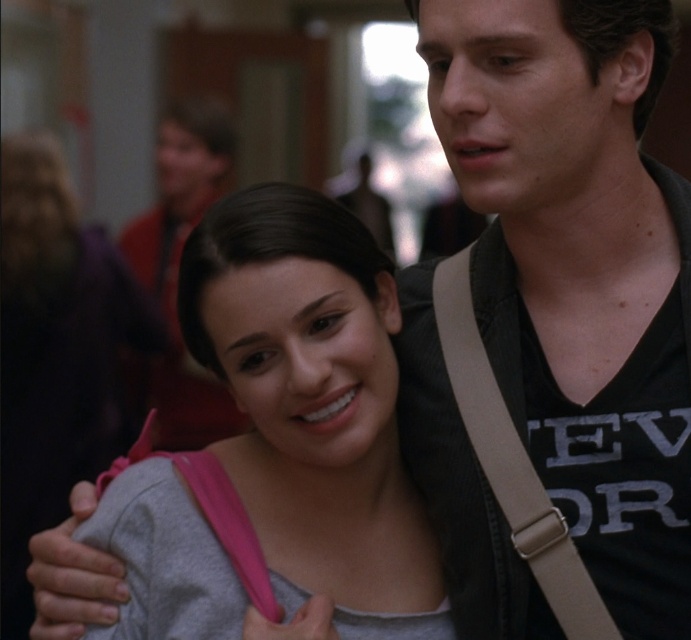
Question: Considering the relative positions of gray matte tank top at center and tan fabric strap at center in the image provided, where is gray matte tank top at center located with respect to tan fabric strap at center?

Choices:
 (A) above
 (B) below

Answer: (B)

Question: Where is gray matte tank top at center located in relation to tan fabric strap at center in the image?

Choices:
 (A) right
 (B) left

Answer: (B)

Question: Does gray matte tank top at center appear on the left side of tan fabric strap at center?

Choices:
 (A) yes
 (B) no

Answer: (A)

Question: Which of the following is the farthest from the observer?

Choices:
 (A) (484, 465)
 (B) (189, 618)

Answer: (A)

Question: Which of the following is the closest to the observer?

Choices:
 (A) gray matte tank top at center
 (B) tan fabric strap at center

Answer: (A)